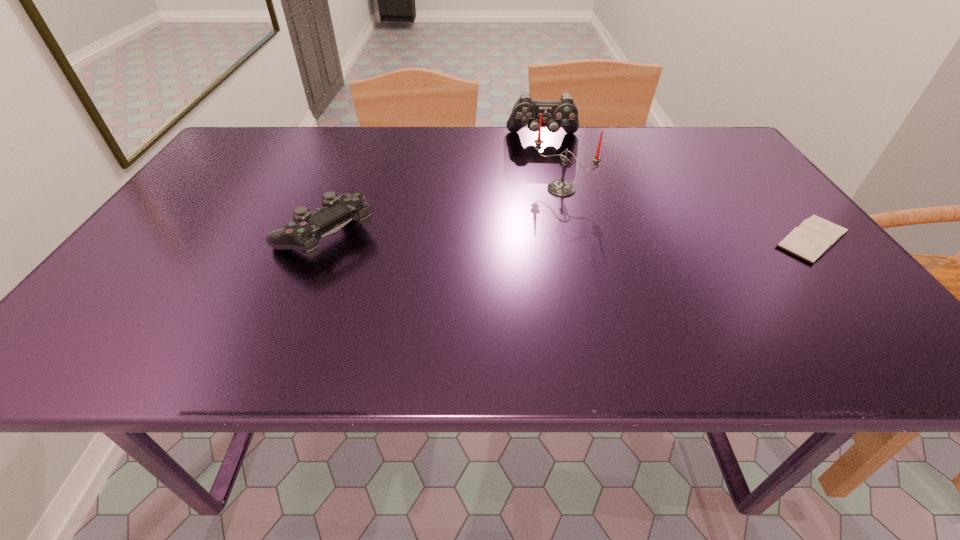
Locate an element on the screen. The width and height of the screenshot is (960, 540). the shorter control is located at coordinates (303, 234).

Where is `the third tallest object`? The image size is (960, 540). the third tallest object is located at coordinates (303, 234).

Identify the location of diary. (815, 236).

You are a GUI agent. You are given a task and a screenshot of the screen. Output one action in this format:
    pyautogui.click(x=<x>, y=<y>)
    Task: Click on the shortest object
    Image resolution: width=960 pixels, height=540 pixels.
    Given the screenshot: What is the action you would take?
    815,236

Where is `the third nearest object`? The width and height of the screenshot is (960, 540). the third nearest object is located at coordinates (562, 188).

I want to click on the tallest object, so click(x=562, y=188).

The image size is (960, 540). I want to click on the farther control, so click(563, 113).

Where is `the farthest object`? This screenshot has height=540, width=960. the farthest object is located at coordinates (563, 113).

Locate an element on the screen. The width and height of the screenshot is (960, 540). vacant space situated 0.300m on the back of the left control is located at coordinates (360, 146).

Identify the location of free space located 0.070m on the left of the diary. This screenshot has width=960, height=540. (738, 239).